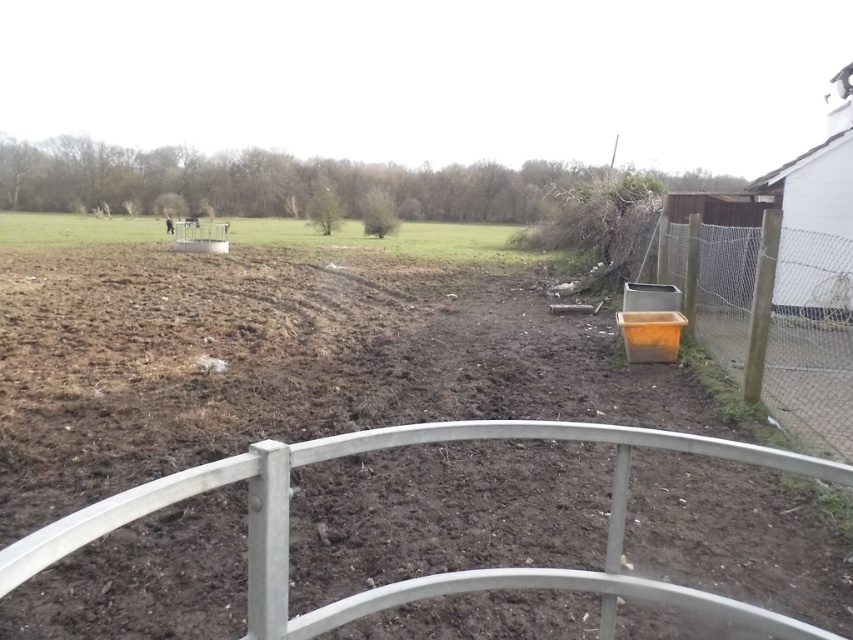
You are a farmer planning to place a new tool shed in your farm. You want to ensure it doesn not block the view of the green grass at upper left from the orange plastic container at right. Given their sizes, is this possible?

The orange plastic container at right has a smaller size compared to green grass at upper left, so it is possible to place the tool shed without blocking the view as the container is smaller and less likely to obstruct the grass area.

You are a farmer planning to place a new rectangular garden bed in the field. The garden bed requires a space wider than the orange plastic container at right but narrower than the green grass at upper left. Is there enough space in the field to accommodate this garden bed?

The orange plastic container at right is narrower than the green grass at upper left. Since the garden bed needs to be wider than the orange plastic container at right but narrower than the green grass at upper left, there is sufficient space in the field to place the garden bed as the required width falls between these two measurements.